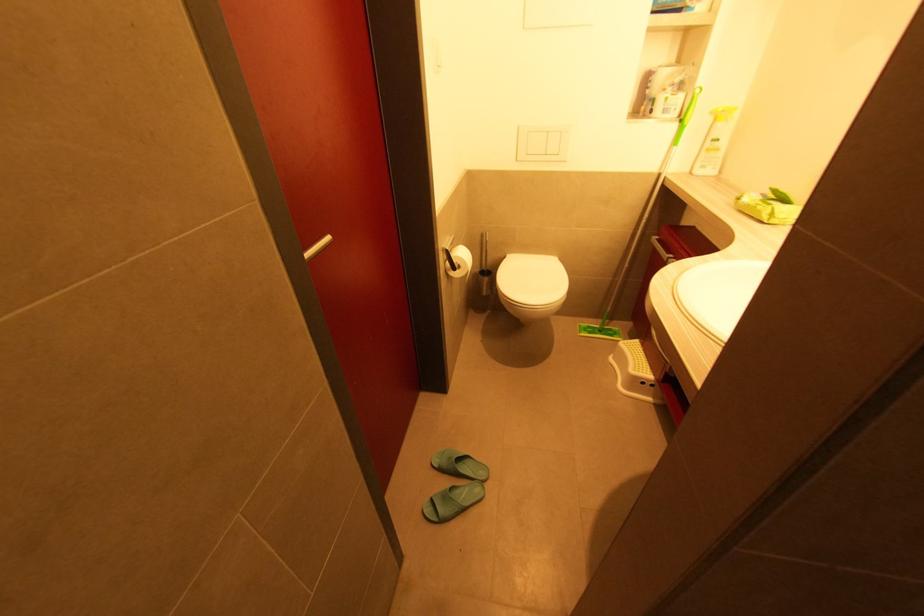
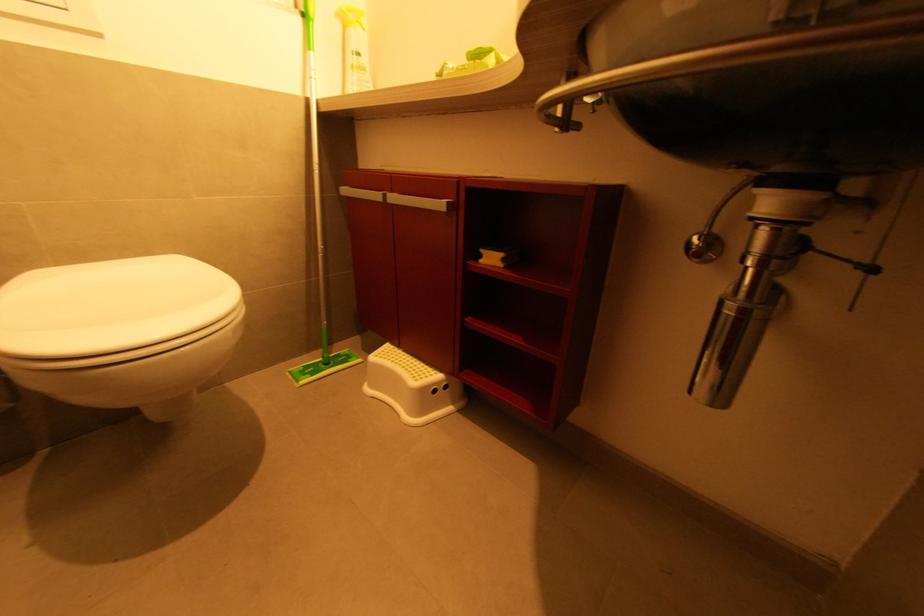
Question: The camera is either moving clockwise (left) or counter-clockwise (right) around the object. The first image is from the beginning of the video and the second image is from the end. Is the camera moving left or right when shooting the video?

Choices:
 (A) Left
 (B) Right

Answer: (A)